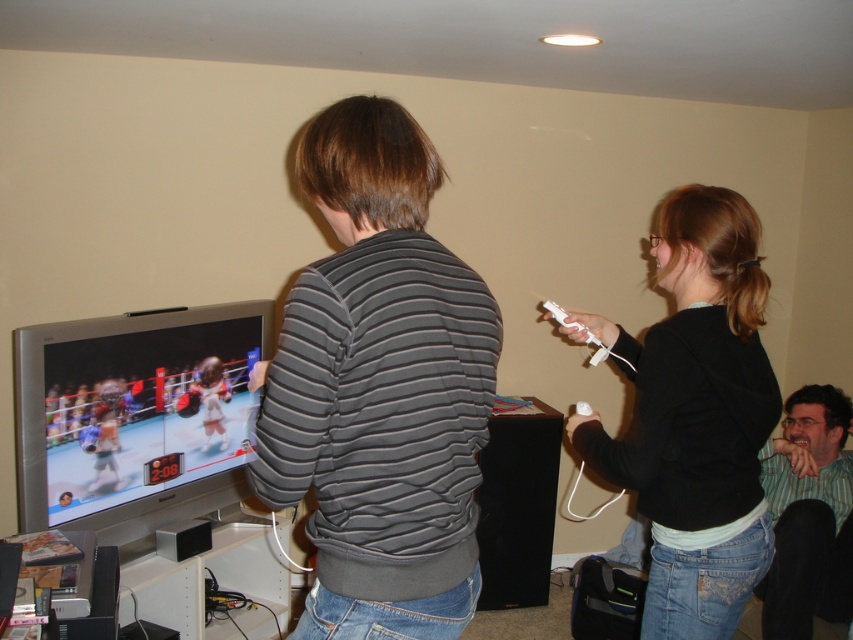
Is the position of green striped shirt at lower right more distant than that of white matte game controller at right?

Yes, it is.

Is green striped shirt at lower right to the right of white matte game controller at right from the viewer's perspective?

Indeed, green striped shirt at lower right is positioned on the right side of white matte game controller at right.

The height and width of the screenshot is (640, 853). What do you see at coordinates (808, 515) in the screenshot?
I see `green striped shirt at lower right` at bounding box center [808, 515].

The image size is (853, 640). In order to click on green striped shirt at lower right in this screenshot , I will do `click(808, 515)`.

Based on the photo, can you confirm if striped cotton shirt at center is positioned above green striped shirt at lower right?

Correct, striped cotton shirt at center is located above green striped shirt at lower right.

Who is taller, striped cotton shirt at center or green striped shirt at lower right?

With more height is striped cotton shirt at center.

In order to click on striped cotton shirt at center in this screenshot , I will do `click(379, 387)`.

Who is shorter, black knit sweater at upper right or green striped shirt at lower right?

Standing shorter between the two is green striped shirt at lower right.

Can you confirm if black knit sweater at upper right is positioned below green striped shirt at lower right?

Incorrect, black knit sweater at upper right is not positioned below green striped shirt at lower right.

What do you see at coordinates (695, 417) in the screenshot?
I see `black knit sweater at upper right` at bounding box center [695, 417].

The height and width of the screenshot is (640, 853). Find the location of `black knit sweater at upper right`. black knit sweater at upper right is located at coordinates (695, 417).